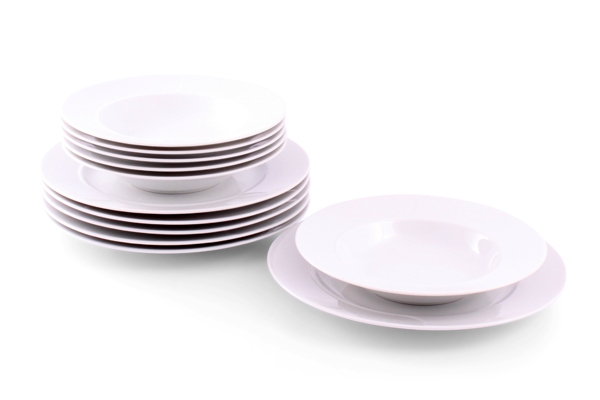
Where is `bowls`? The height and width of the screenshot is (400, 600). bowls is located at coordinates (142, 174), (157, 169), (152, 160), (163, 154), (163, 145), (409, 294).